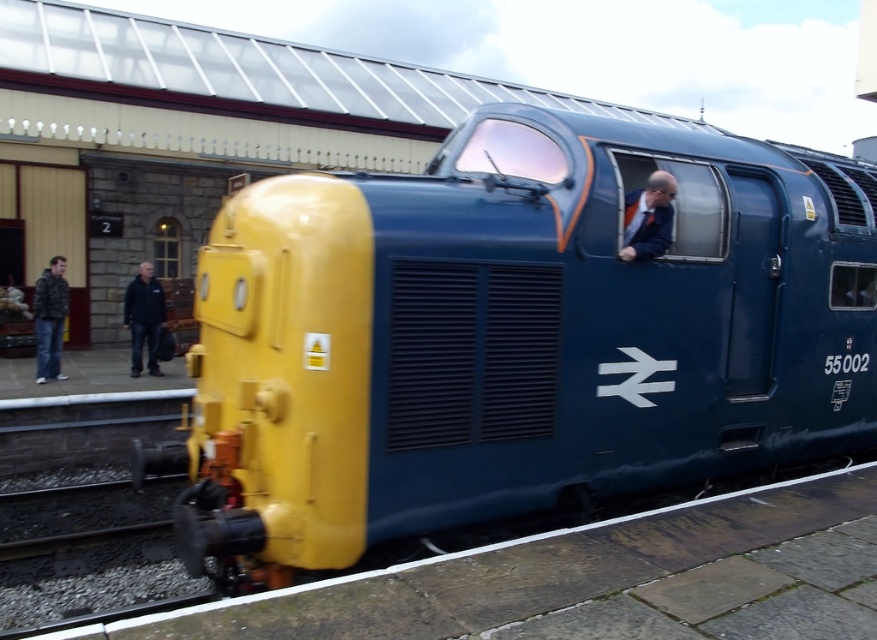
Is matte blue train at center to the left of matte blue suit at center from the viewer's perspective?

Indeed, matte blue train at center is positioned on the left side of matte blue suit at center.

Is matte blue train at center thinner than matte blue suit at center?

In fact, matte blue train at center might be wider than matte blue suit at center.

Looking at this image, who is more forward, (486, 304) or (646, 250)?

Positioned in front is point (486, 304).

Locate an element on the screen. matte blue train at center is located at coordinates (512, 337).

Does matte blue suit at center appear over black jacket at left?

Yes, matte blue suit at center is above black jacket at left.

In order to click on matte blue suit at center in this screenshot , I will do `click(647, 218)`.

Does point (628, 220) come farther from viewer compared to point (154, 300)?

No, (628, 220) is closer to viewer.

Locate an element on the screen. The height and width of the screenshot is (640, 877). matte blue suit at center is located at coordinates (647, 218).

Is point (44, 294) farther from viewer compared to point (151, 280)?

No.

In the scene shown: Is dark gray jacket at left closer to the viewer compared to black jacket at left?

Yes, it is in front of black jacket at left.

Does point (61, 294) lie behind point (164, 317)?

No, (61, 294) is in front of (164, 317).

The image size is (877, 640). Identify the location of dark gray jacket at left. pyautogui.click(x=50, y=317).